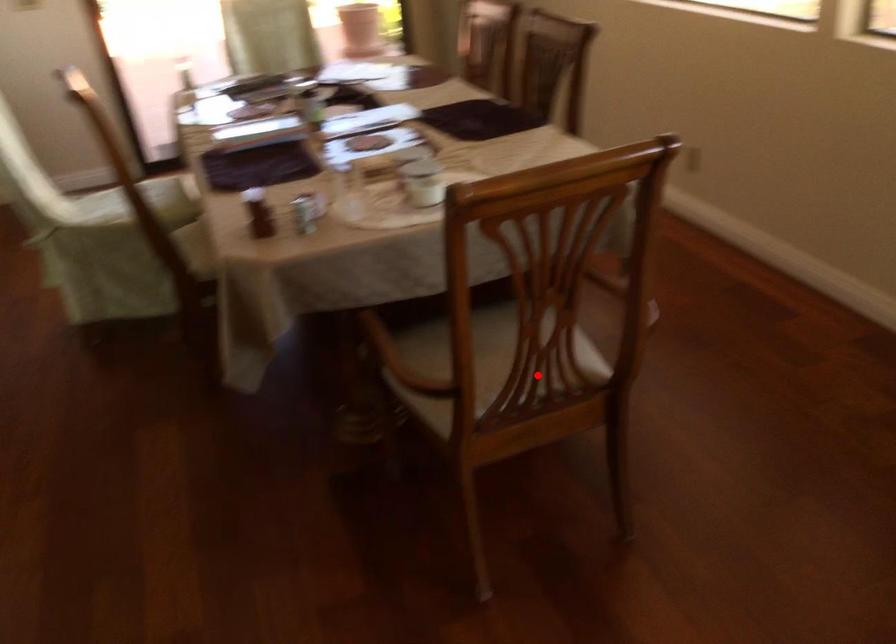
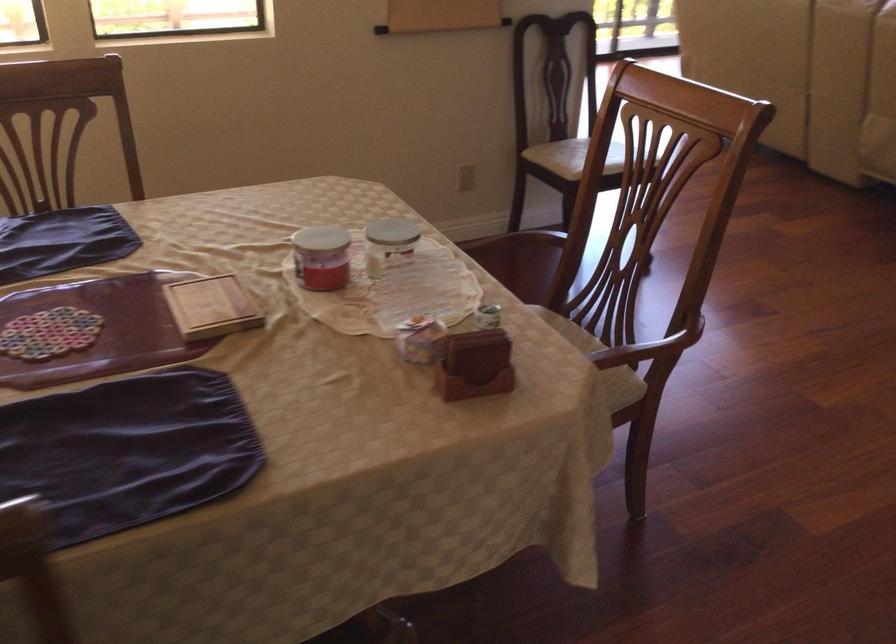
Question: A red point is marked in image1. In image2, is the corresponding 3D point closer to the camera or farther? Reply with the corresponding letter.

Choices:
 (A) The corresponding 3D point is closer.
 (B) The corresponding 3D point is farther.

Answer: (B)